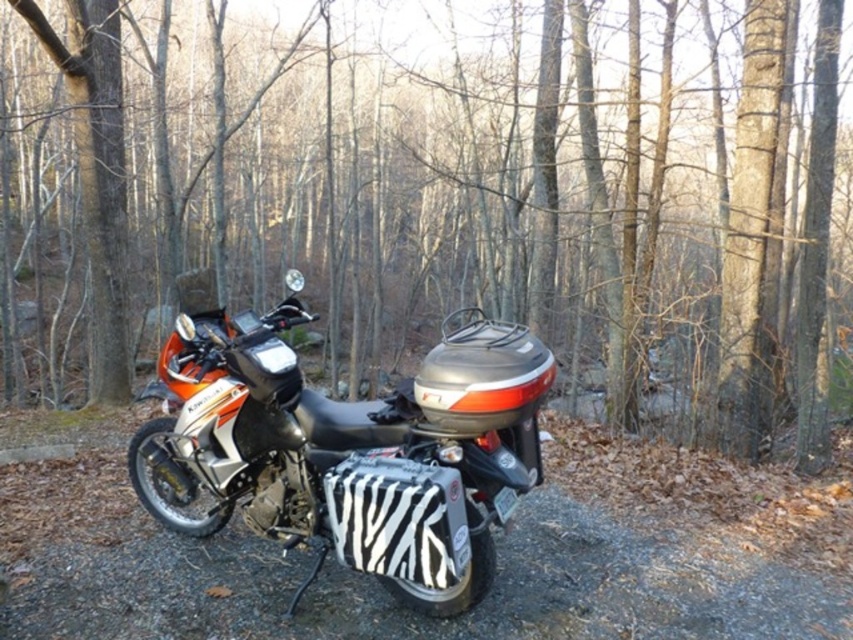
Between brown bark tree at center and zebra-patterned bag at center, which one has less height?

Standing shorter between the two is zebra-patterned bag at center.

Which is below, brown bark tree at center or zebra-patterned bag at center?

zebra-patterned bag at center is lower down.

Where is `brown bark tree at center`? The image size is (853, 640). brown bark tree at center is located at coordinates (434, 205).

The height and width of the screenshot is (640, 853). Find the location of `brown bark tree at center`. brown bark tree at center is located at coordinates (434, 205).